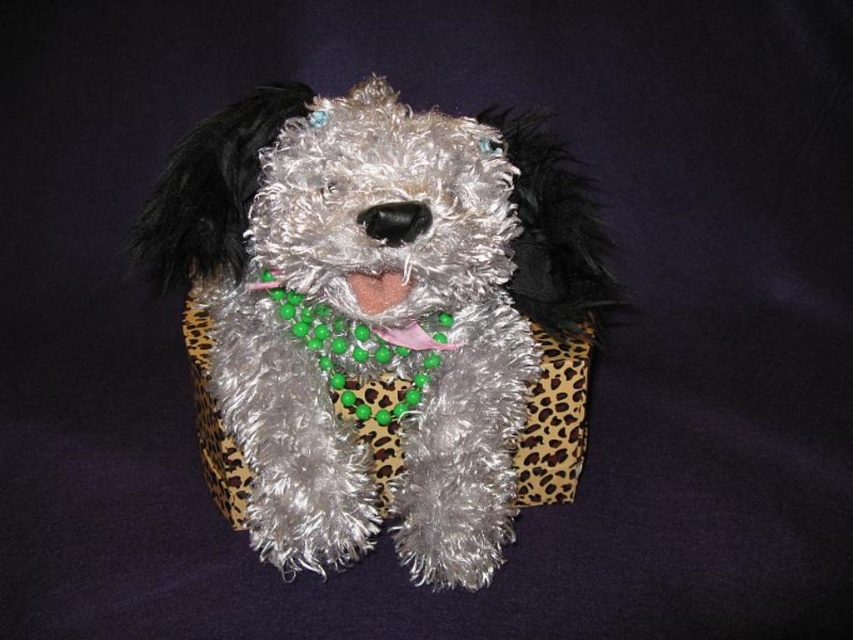
Question: Is fuzzy silver dog at center bigger than pink fabric at center?

Choices:
 (A) yes
 (B) no

Answer: (A)

Question: Which of the following is the closest to the observer?

Choices:
 (A) fuzzy silver dog at center
 (B) green beaded necklace at center
 (C) pink fabric at center

Answer: (A)

Question: Is fuzzy silver dog at center to the right of pink fabric at center from the viewer's perspective?

Choices:
 (A) yes
 (B) no

Answer: (A)

Question: Is green beaded necklace at center to the right of pink fabric at center from the viewer's perspective?

Choices:
 (A) no
 (B) yes

Answer: (A)

Question: Which point is farther to the camera?

Choices:
 (A) (367, 282)
 (B) (381, 346)
 (C) (357, 301)

Answer: (B)

Question: Which point is closer to the camera?

Choices:
 (A) (289, 468)
 (B) (349, 285)
 (C) (384, 304)

Answer: (C)